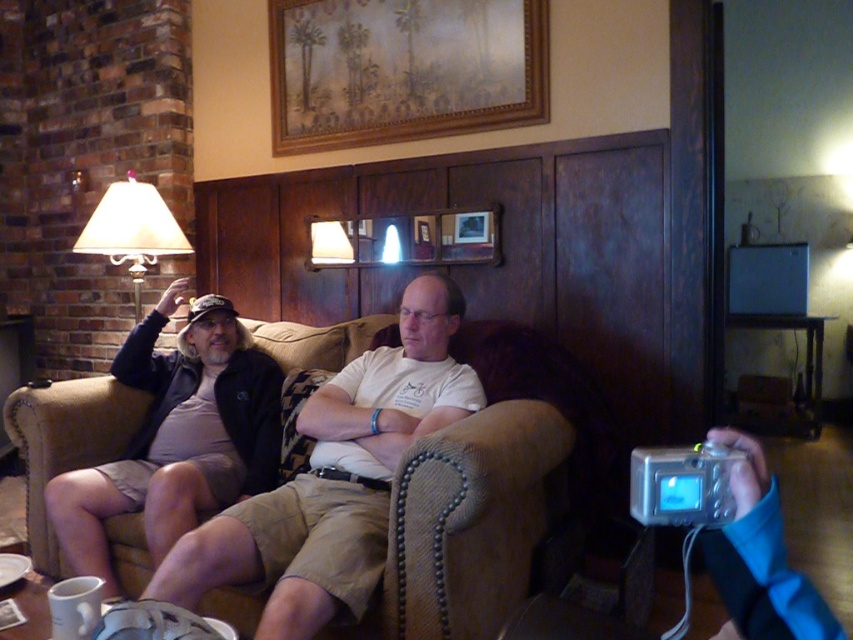
Who is more distant from viewer, [178,452] or [137,241]?

The point [137,241] is more distant.

Who is more forward, (x=83, y=502) or (x=151, y=220)?

Point (x=83, y=502)

Identify the location of matte black jacket at left. This screenshot has width=853, height=640. (177, 435).

Does suede couch at center appear over matte beige lampshade at left?

Actually, suede couch at center is below matte beige lampshade at left.

From the picture: Is suede couch at center positioned before matte beige lampshade at left?

Yes, suede couch at center is in front of matte beige lampshade at left.

Describe the element at coordinates (469, 524) in the screenshot. I see `suede couch at center` at that location.

I want to click on suede couch at center, so click(469, 524).

In the scene shown: Can you confirm if suede couch at center is smaller than matte black jacket at left?

Indeed, suede couch at center has a smaller size compared to matte black jacket at left.

What are the coordinates of `suede couch at center` in the screenshot? It's located at (469, 524).